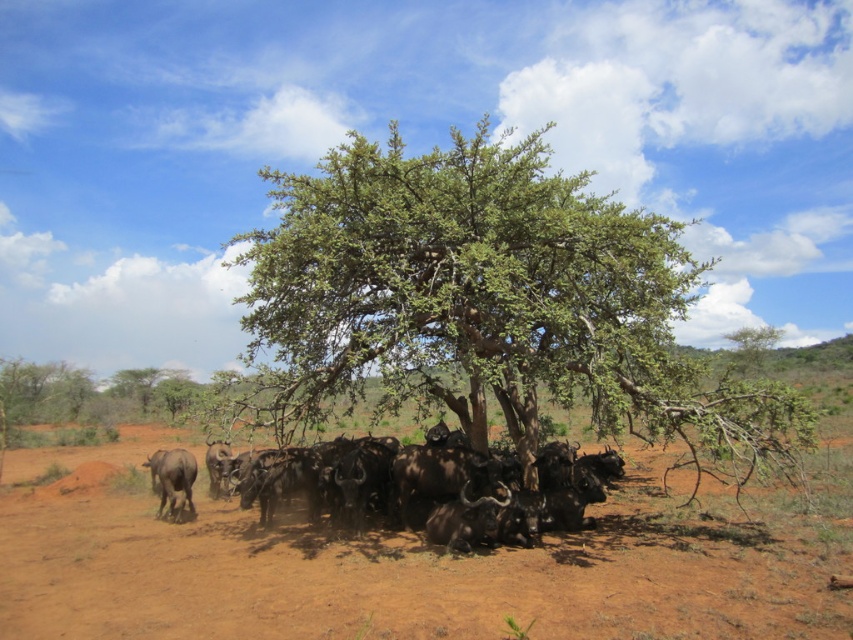
Question: Is brown dirt field at center to the left of brown rough yak at lower left from the viewer's perspective?

Choices:
 (A) no
 (B) yes

Answer: (A)

Question: Estimate the real-world distances between objects in this image. Which object is farther from the green leafy tree at center?

Choices:
 (A) brown rough yak at lower left
 (B) brown dirt field at center
 (C) black glossy buffalo at lower center

Answer: (A)

Question: Which of the following is the farthest from the observer?

Choices:
 (A) (315, 342)
 (B) (158, 488)
 (C) (523, 492)

Answer: (B)

Question: Which object is positioned closest to the black glossy buffalo at lower center?

Choices:
 (A) green leafy tree at center
 (B) brown dirt field at center
 (C) brown rough yak at lower left

Answer: (C)

Question: Is brown dirt field at center further to camera compared to black glossy buffalo at lower center?

Choices:
 (A) yes
 (B) no

Answer: (B)

Question: Is green leafy tree at center behind black glossy buffalo at lower center?

Choices:
 (A) yes
 (B) no

Answer: (B)